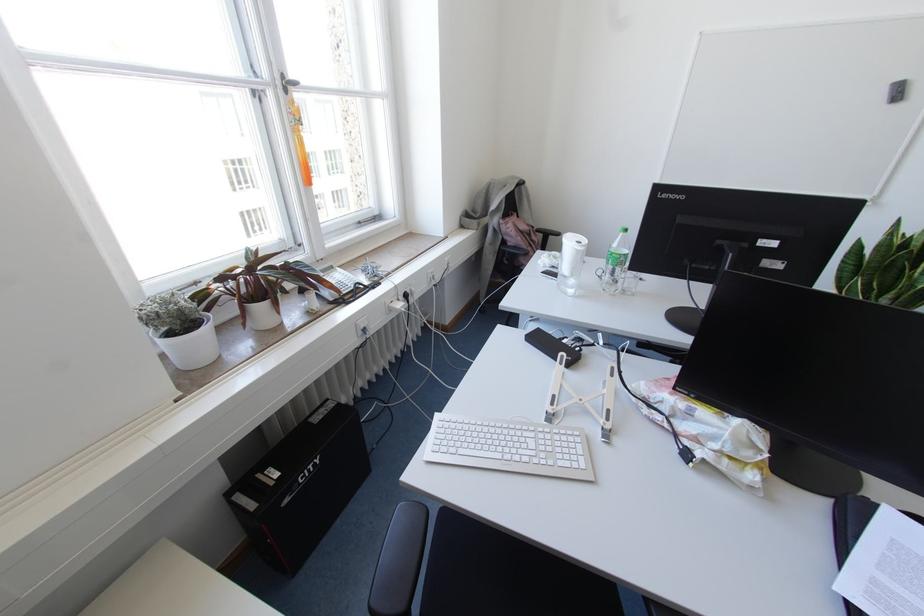
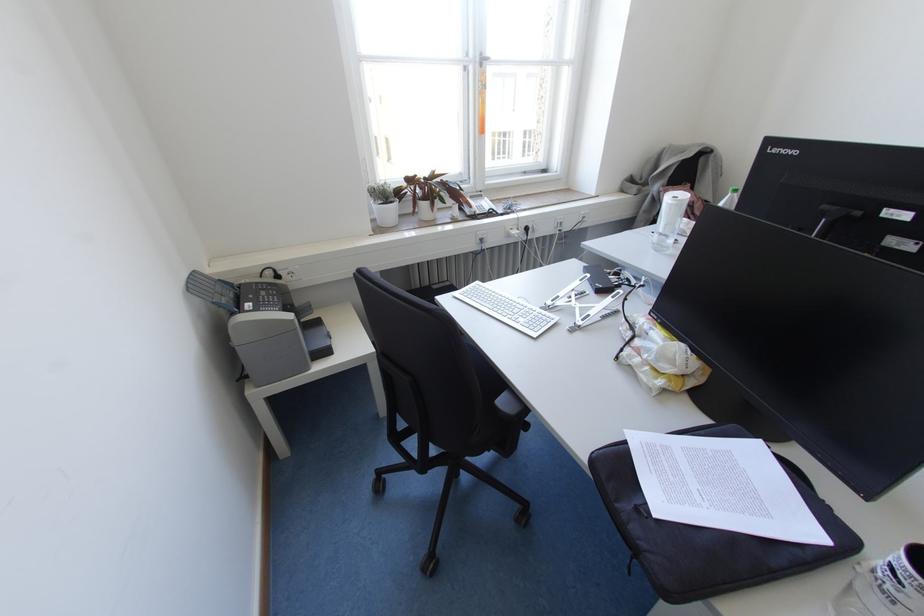
Locate, in the second image, the point that corresponds to point (186, 298) in the first image.

(390, 187)